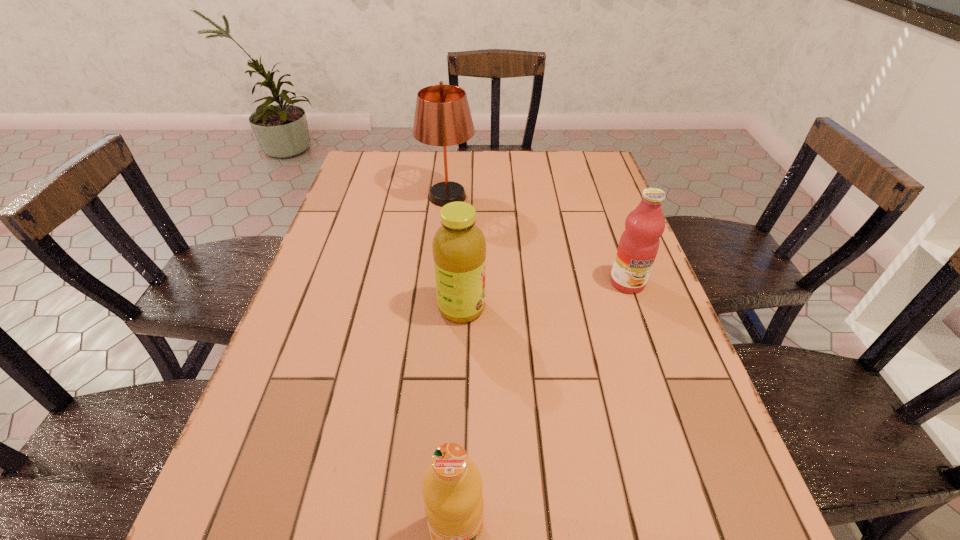
Image resolution: width=960 pixels, height=540 pixels. Identify the location of the tallest object. (442, 117).

Find the location of a particular element. the farthest object is located at coordinates (442, 117).

I want to click on the rightmost fruit juice, so (x=639, y=243).

What are the coordinates of `free region located on the front-facing side of the lampshade` in the screenshot? It's located at (438, 292).

Locate an element on the screen. vacant region located on the label of the rightmost object is located at coordinates (647, 338).

Locate an element on the screen. This screenshot has width=960, height=540. object that is positioned at the far edge is located at coordinates (442, 117).

Locate an element on the screen. object that is at the right edge is located at coordinates 639,243.

Identify the location of vacant space at the far edge of the desktop. (538, 181).

In order to click on vacant space at the left edge of the desktop in this screenshot , I will do `click(244, 470)`.

The height and width of the screenshot is (540, 960). In order to click on vacant space at the right edge of the desktop in this screenshot , I will do `click(579, 241)`.